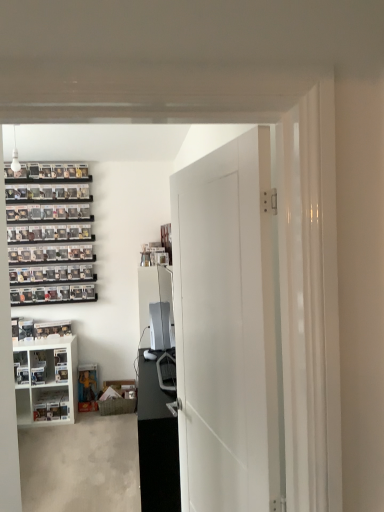
Question: Considering the relative positions of white matte door at center and black glossy entertainment center at center in the image provided, is white matte door at center behind black glossy entertainment center at center?

Choices:
 (A) yes
 (B) no

Answer: (B)

Question: From a real-world perspective, is white matte door at center over black glossy entertainment center at center?

Choices:
 (A) no
 (B) yes

Answer: (B)

Question: Is white matte door at center surrounding black glossy entertainment center at center?

Choices:
 (A) no
 (B) yes

Answer: (A)

Question: Is white matte door at center not near black glossy entertainment center at center?

Choices:
 (A) yes
 (B) no

Answer: (B)

Question: Considering the relative sizes of white matte door at center and black glossy entertainment center at center in the image provided, is white matte door at center shorter than black glossy entertainment center at center?

Choices:
 (A) no
 (B) yes

Answer: (A)

Question: Is white matte door at center taller or shorter than black glossy entertainment center at center?

Choices:
 (A) tall
 (B) short

Answer: (A)

Question: Which is correct: white matte door at center is inside black glossy entertainment center at center, or outside of it?

Choices:
 (A) outside
 (B) inside

Answer: (A)

Question: From a real-world perspective, is white matte door at center above or below black glossy entertainment center at center?

Choices:
 (A) above
 (B) below

Answer: (A)

Question: Considering the positions of white matte door at center and black glossy entertainment center at center in the image, is white matte door at center bigger or smaller than black glossy entertainment center at center?

Choices:
 (A) small
 (B) big

Answer: (A)

Question: From a real-world perspective, is white glossy cabinet at lower left above or below white matte door at center?

Choices:
 (A) below
 (B) above

Answer: (A)

Question: Do you think white glossy cabinet at lower left is within white matte door at center, or outside of it?

Choices:
 (A) outside
 (B) inside

Answer: (A)

Question: Considering the positions of white glossy cabinet at lower left and white matte door at center in the image, is white glossy cabinet at lower left bigger or smaller than white matte door at center?

Choices:
 (A) small
 (B) big

Answer: (B)

Question: From the image's perspective, is white glossy cabinet at lower left located above or below white matte door at center?

Choices:
 (A) above
 (B) below

Answer: (B)

Question: Looking at their shapes, would you say black glossy entertainment center at center is wider or thinner than white matte door at center?

Choices:
 (A) wide
 (B) thin

Answer: (A)

Question: Is point (144, 445) positioned closer to the camera than point (228, 332)?

Choices:
 (A) farther
 (B) closer

Answer: (A)